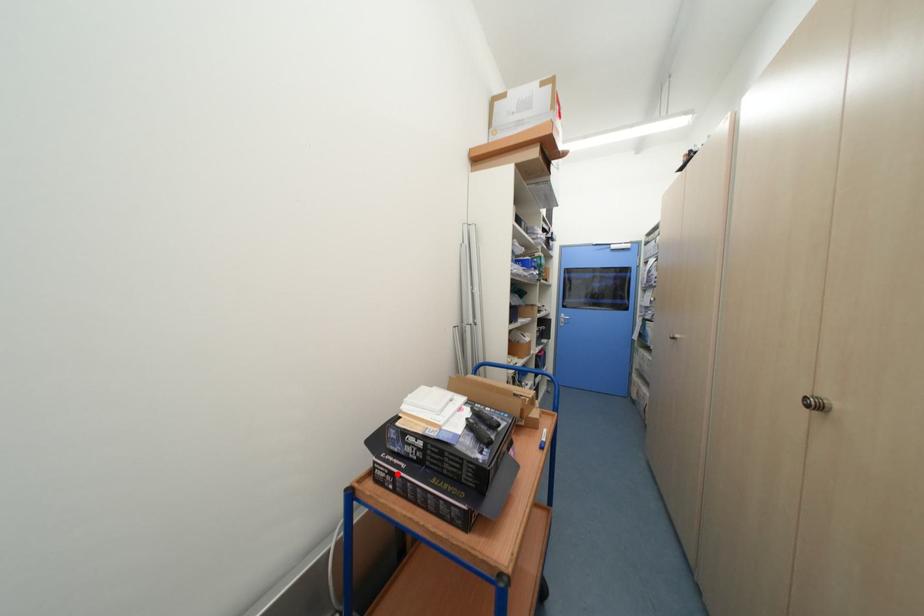
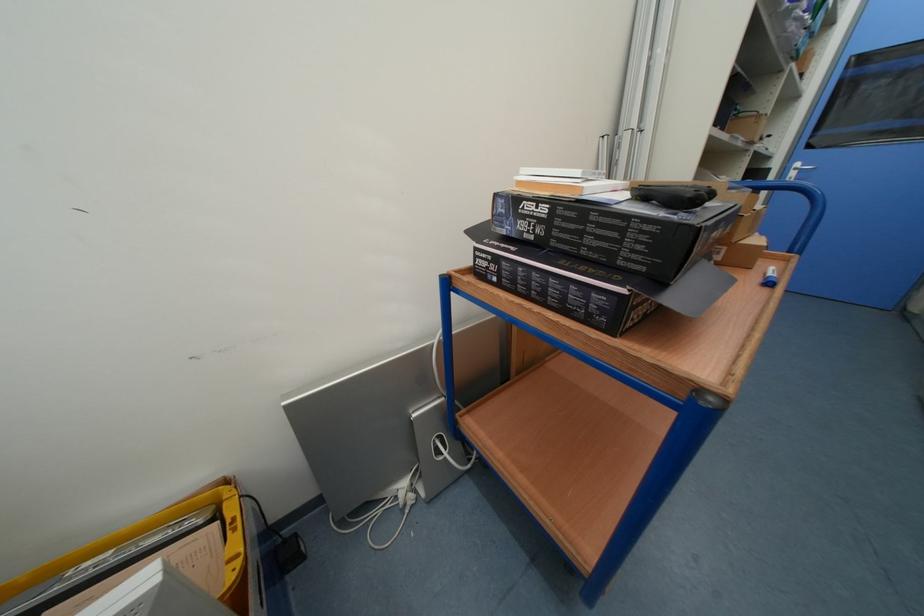
Question: I am providing you with two images of the same scene from different viewpoints. A red point is shown in image1. For the corresponding object point in image2, is it positioned nearer or farther from the camera?

Choices:
 (A) Nearer
 (B) Farther

Answer: (A)